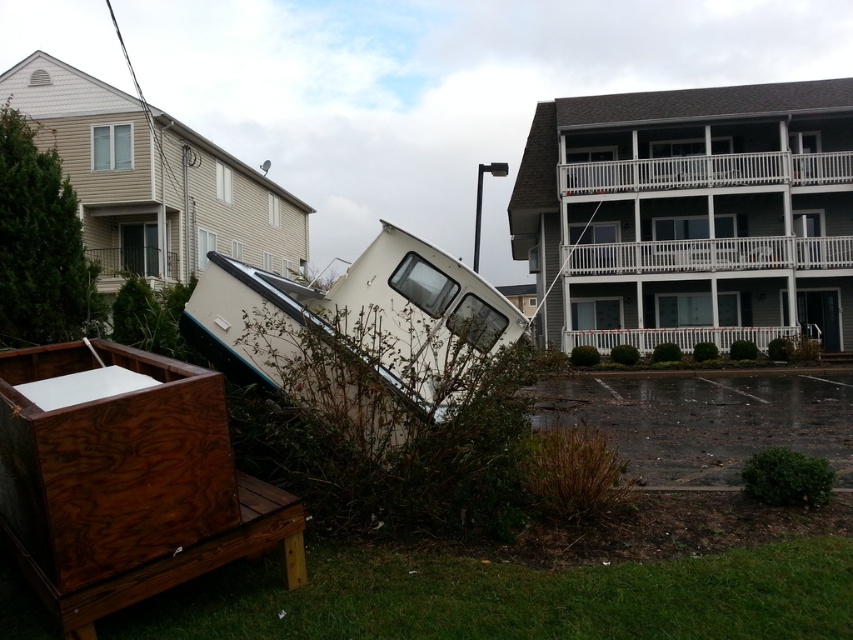
Question: Which point appears farthest from the camera in this image?

Choices:
 (A) (62, 444)
 (B) (445, 349)

Answer: (B)

Question: Considering the relative positions of wooden crate at lower left and white matte boat at center in the image provided, where is wooden crate at lower left located with respect to white matte boat at center?

Choices:
 (A) right
 (B) left

Answer: (B)

Question: Which of the following is the farthest from the observer?

Choices:
 (A) white matte boat at center
 (B) wooden crate at lower left

Answer: (A)

Question: Does wooden crate at lower left appear on the right side of white matte boat at center?

Choices:
 (A) yes
 (B) no

Answer: (B)

Question: Observing the image, what is the correct spatial positioning of wooden crate at lower left in reference to white matte boat at center?

Choices:
 (A) above
 (B) below

Answer: (B)

Question: Which point is farther to the camera?

Choices:
 (A) white matte boat at center
 (B) wooden crate at lower left

Answer: (A)